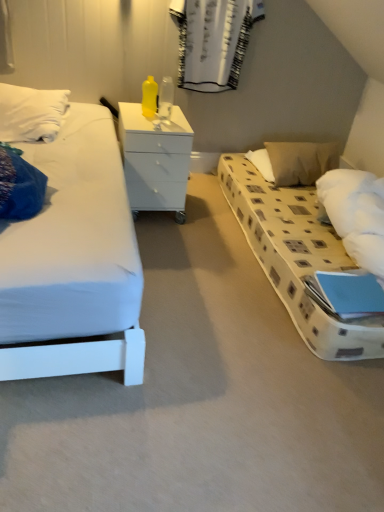
Question: Considering the positions of white textured curtain at upper center and white glossy chest of drawers at center in the image, is white textured curtain at upper center bigger or smaller than white glossy chest of drawers at center?

Choices:
 (A) small
 (B) big

Answer: (A)

Question: From a real-world perspective, relative to white glossy chest of drawers at center, is white textured curtain at upper center vertically above or below?

Choices:
 (A) above
 (B) below

Answer: (A)

Question: Estimate the real-world distances between objects in this image. Which object is closer to the beige fabric pillow at right?

Choices:
 (A) white textured curtain at upper center
 (B) white glossy chest of drawers at center

Answer: (A)

Question: Which of these objects is positioned closest to the beige fabric pillow at right?

Choices:
 (A) white glossy chest of drawers at center
 (B) white textured curtain at upper center

Answer: (B)